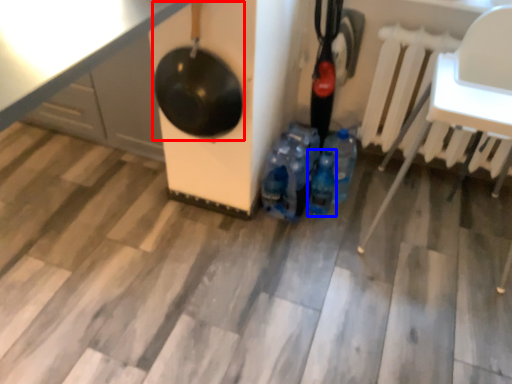
Question: Among these objects, which one is farthest to the camera, wok (highlighted by a red box) or bottle (highlighted by a blue box)?

Choices:
 (A) wok
 (B) bottle

Answer: (B)